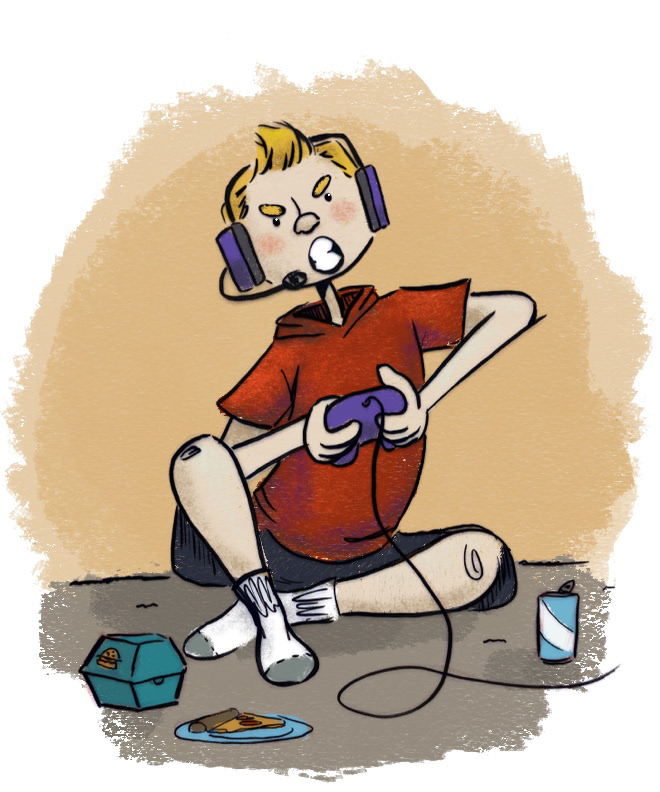
The height and width of the screenshot is (792, 660). What are the coordinates of `floor` in the screenshot? It's located at (469, 721).